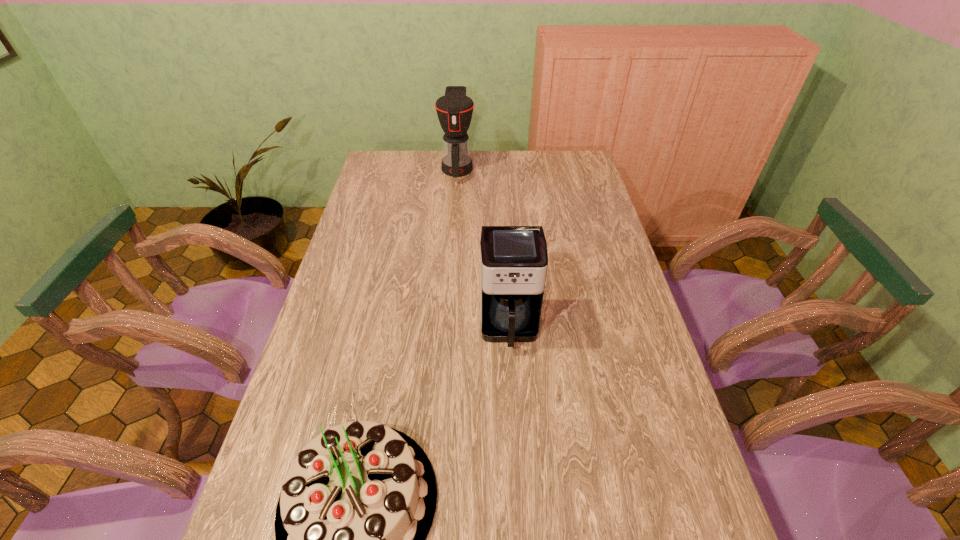
Locate an element on the screen. This screenshot has width=960, height=540. the left coffee maker is located at coordinates (454, 110).

Where is `the farthest object`? the farthest object is located at coordinates (454, 110).

Where is `the nearer coffee maker`? the nearer coffee maker is located at coordinates (513, 259).

Locate an element on the screen. the rightmost object is located at coordinates (513, 259).

At what (x,y) coordinates should I click in order to perform the action: click on free space located pour from the carafe of the farthest object. Please return your answer as a coordinate pair (x, y). This screenshot has height=540, width=960. Looking at the image, I should click on (451, 249).

Identify the location of vacant space located on the front panel of the right coffee maker. (515, 424).

I want to click on object that is at the far edge, so click(x=454, y=110).

I want to click on vacant space at the far edge of the desktop, so click(503, 159).

The image size is (960, 540). In the image, there is a desktop. Identify the location of vacant space at the left edge. (357, 313).

What are the coordinates of `free spot at the right edge of the desktop` in the screenshot? It's located at (659, 366).